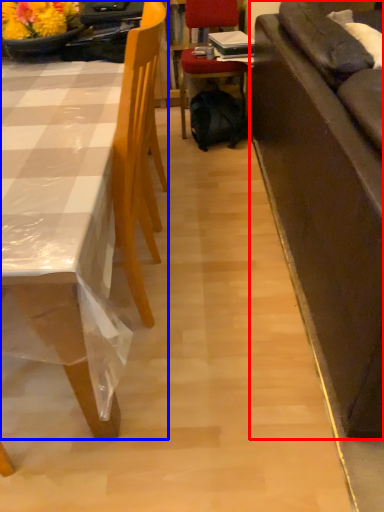
Question: Which of the following is the farthest to the observer, studio couch (highlighted by a red box) or chair (highlighted by a blue box)?

Choices:
 (A) studio couch
 (B) chair

Answer: (B)